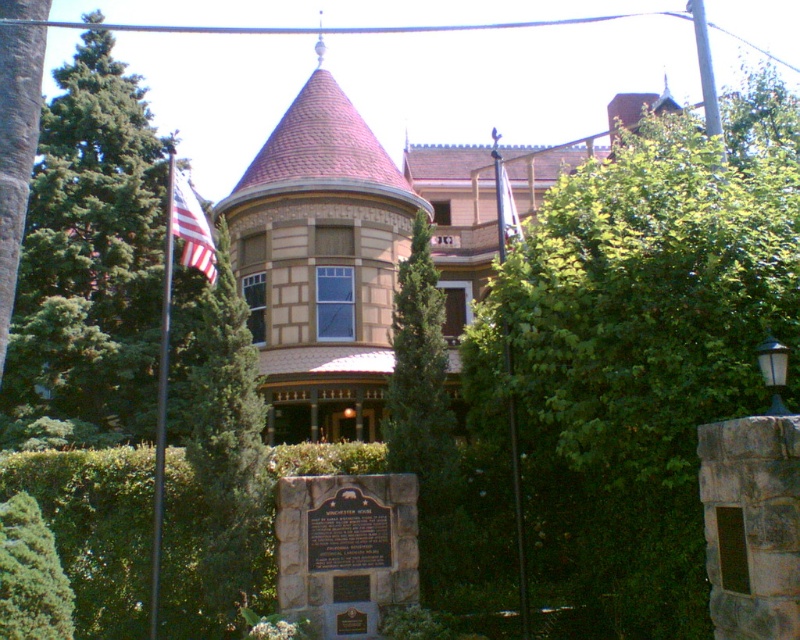
Question: Which point is farther from the camera taking this photo?

Choices:
 (A) (310, 196)
 (B) (22, 593)
 (C) (516, 234)
 (D) (6, 445)

Answer: (A)

Question: Is the position of green textured tree at left more distant than that of american flag at left?

Choices:
 (A) yes
 (B) no

Answer: (B)

Question: Can you confirm if green leafy tree at left is wider than green textured tree at left?

Choices:
 (A) yes
 (B) no

Answer: (A)

Question: Among these objects, which one is nearest to the camera?

Choices:
 (A) brown textured mansion at center
 (B) green leafy hedge at lower left

Answer: (B)

Question: Based on their relative distances, which object is farther from the green leafy hedge at lower left?

Choices:
 (A) brown textured mansion at center
 (B) green textured tree at left

Answer: (A)

Question: Does brown textured mansion at center lie in front of green leafy tree at left?

Choices:
 (A) yes
 (B) no

Answer: (A)